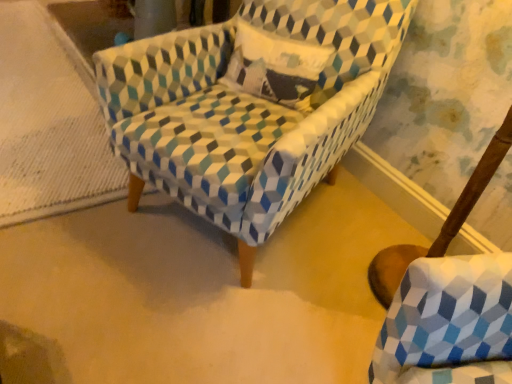
Identify the location of vacant region to the left of textured fabric swivel chair at lower right. (343, 225).